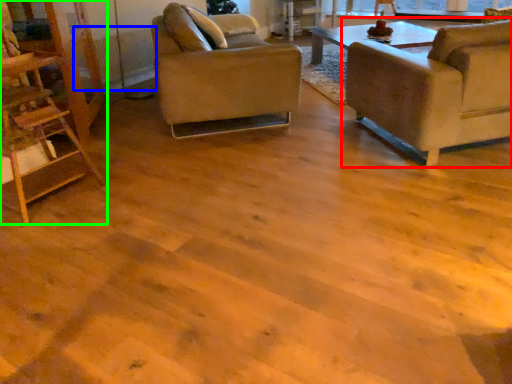
Question: Considering the real-world distances, which object is closest to chair (highlighted by a red box)? radiator (highlighted by a blue box) or ladder (highlighted by a green box).

Choices:
 (A) radiator
 (B) ladder

Answer: (B)